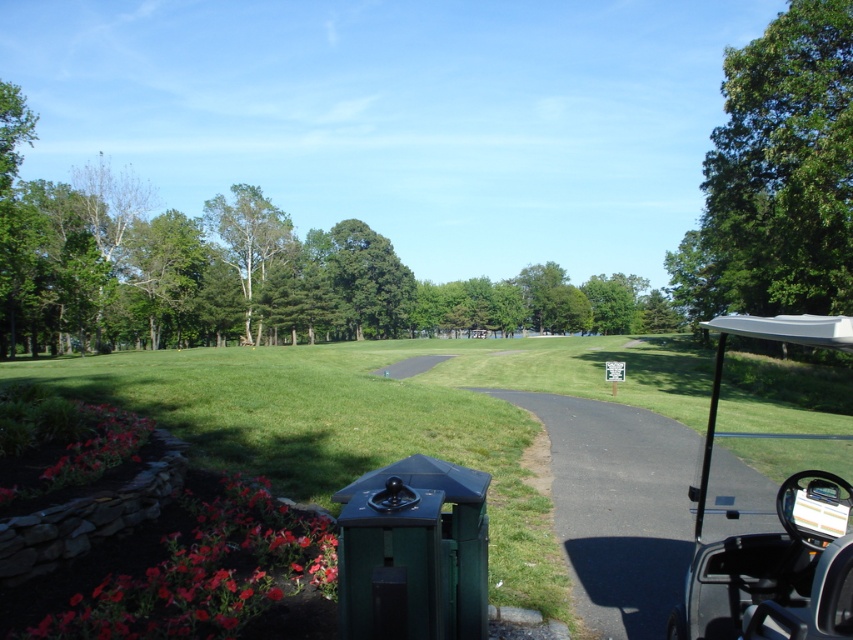
Question: Observing the image, what is the correct spatial positioning of silver metallic golf cart at right in reference to green leafy tree at upper center?

Choices:
 (A) below
 (B) above

Answer: (A)

Question: Can you confirm if green matte golf course at center is smaller than green leafy tree at upper right?

Choices:
 (A) yes
 (B) no

Answer: (A)

Question: Which object is closer to the camera taking this photo?

Choices:
 (A) green leafy tree at upper right
 (B) green matte golf course at center
 (C) silver metallic golf cart at right

Answer: (C)

Question: Which of the following is the closest to the observer?

Choices:
 (A) green leafy tree at upper center
 (B) green matte golf course at center
 (C) green leafy tree at upper right

Answer: (B)

Question: Which point is closer to the camera?

Choices:
 (A) (827, 205)
 (B) (212, 218)

Answer: (A)

Question: Can you confirm if green leafy tree at upper right is thinner than green leafy tree at upper center?

Choices:
 (A) no
 (B) yes

Answer: (B)